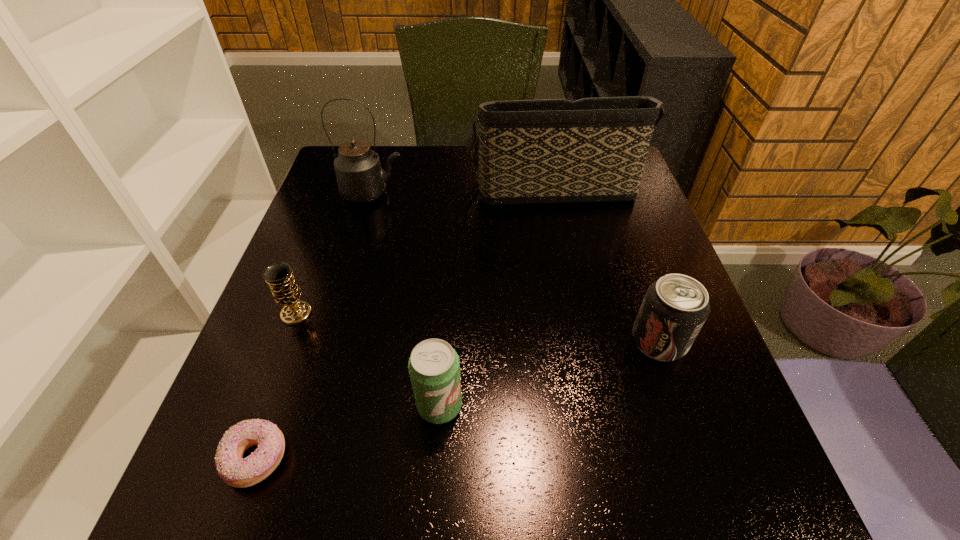
Locate an element on the screen. This screenshot has width=960, height=540. kettle is located at coordinates (360, 178).

Find the location of a particular element. handbag is located at coordinates (547, 151).

Find the location of a particular element. The height and width of the screenshot is (540, 960). the left soda can is located at coordinates click(434, 369).

This screenshot has width=960, height=540. I want to click on the right soda can, so click(675, 307).

In order to click on the second shortest object in this screenshot , I will do `click(279, 276)`.

What are the coordinates of `doughnut` in the screenshot? It's located at (236, 471).

Identify the location of free space located 0.160m spout on the kettle. Image resolution: width=960 pixels, height=540 pixels. (466, 193).

Locate an element on the screen. This screenshot has height=540, width=960. vacant space located on the left of the handbag is located at coordinates (325, 187).

The width and height of the screenshot is (960, 540). I want to click on blank area located on the right of the nearer soda can, so click(552, 406).

This screenshot has width=960, height=540. What are the coordinates of `vacant space located on the back of the farther soda can` in the screenshot? It's located at (615, 216).